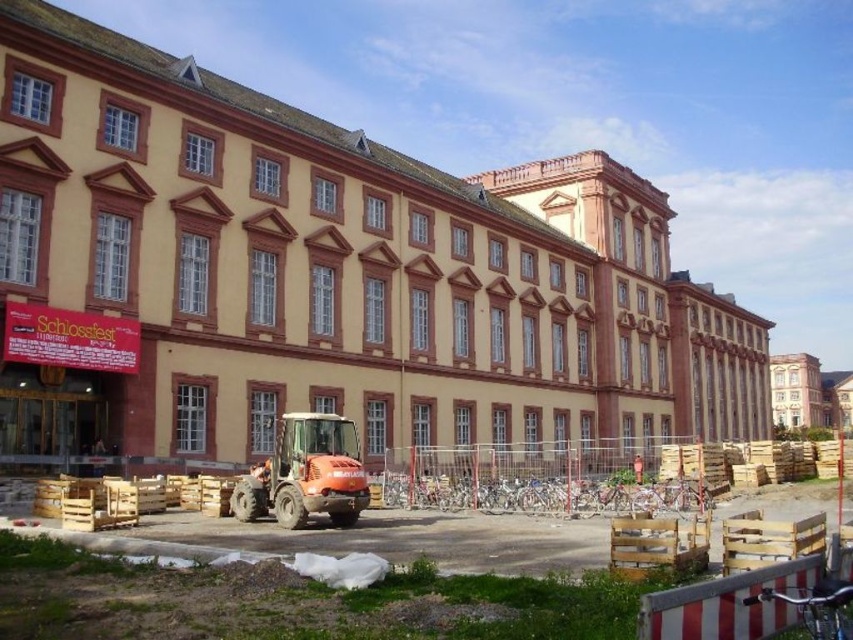
Question: Does orange compact tractor at center have a smaller size compared to orange rubber tractor at center?

Choices:
 (A) yes
 (B) no

Answer: (B)

Question: Can you confirm if orange compact tractor at center is positioned below orange rubber tractor at center?

Choices:
 (A) no
 (B) yes

Answer: (B)

Question: Which point is farther from the camera taking this photo?

Choices:
 (A) (325, 346)
 (B) (274, 464)
 (C) (566, 536)

Answer: (A)

Question: Which of the following is the farthest from the observer?

Choices:
 (A) (488, 436)
 (B) (357, 513)
 (C) (148, 552)

Answer: (A)

Question: Which of the following is the farthest from the observer?

Choices:
 (A) (364, 317)
 (B) (321, 433)
 (C) (437, 531)

Answer: (A)

Question: Does beige stone building at center have a greater width compared to orange rubber tractor at center?

Choices:
 (A) yes
 (B) no

Answer: (A)